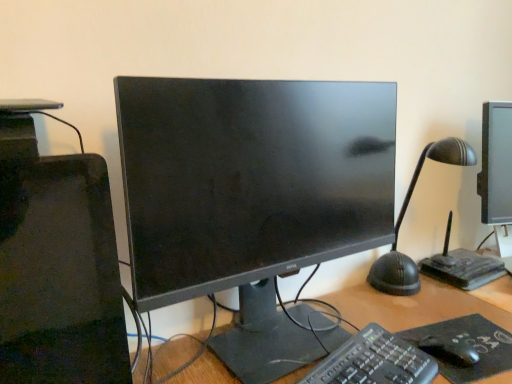
Locate an element on the screen. matte black monitor at center is located at coordinates click(252, 196).

What is the approximate height of matte black monitor at center?

It is 21.86 inches.

This screenshot has width=512, height=384. What are the coordinates of `matte black monitor at center` in the screenshot? It's located at (252, 196).

From a real-world perspective, relative to matte black monitor at center, is black matte mouse at lower right vertically above or below?

black matte mouse at lower right is situated lower than matte black monitor at center in the real world.

Which object is thinner, black matte mouse at lower right or matte black monitor at center?

black matte mouse at lower right.

Would you say black matte mouse at lower right is to the left or to the right of matte black monitor at center in the picture?

From the image, it's evident that black matte mouse at lower right is to the right of matte black monitor at center.

From the image's perspective, which is below, black matte mouse at lower right or matte black monitor at center?

From the image's view, black matte mouse at lower right is below.

Is black plastic keyboard at center wider or thinner than black matte mouse at lower right?

Clearly, black plastic keyboard at center has more width compared to black matte mouse at lower right.

Is black plastic keyboard at center positioned beyond the bounds of black matte mouse at lower right?

Yes, black plastic keyboard at center is not within black matte mouse at lower right.

From a real-world perspective, is black plastic keyboard at center physically below black matte mouse at lower right?

Incorrect, from a real-world perspective, black plastic keyboard at center is higher than black matte mouse at lower right.

Considering the sizes of objects black plastic keyboard at center and black matte mouse at lower right in the image provided, who is taller, black plastic keyboard at center or black matte mouse at lower right?

black plastic keyboard at center is taller.

Is matte black monitor at center facing away from black plastic keyboard at center?

No, black plastic keyboard at center is not at the back of matte black monitor at center.

Is matte black monitor at center further to the viewer compared to black plastic keyboard at center?

That is True.

Does matte black monitor at center have a smaller size compared to black plastic keyboard at center?

Actually, matte black monitor at center might be larger than black plastic keyboard at center.

Does black matte mouse at lower right lie in front of black plastic keyboard at center?

No, it is behind black plastic keyboard at center.

Consider the image. Is black matte mouse at lower right positioned far away from black plastic keyboard at center?

black matte mouse at lower right is near black plastic keyboard at center, not far away.

From a real-world perspective, who is located higher, black matte mouse at lower right or black plastic keyboard at center?

black plastic keyboard at center is physically above.

Which object is positioned more to the left, black matte mouse at lower right or black plastic keyboard at center?

black plastic keyboard at center.

Does black plastic keyboard at center turn towards matte black monitor at center?

No, black plastic keyboard at center is not aimed at matte black monitor at center.

Based on the photo, from a real-world perspective, who is located higher, black plastic keyboard at center or matte black monitor at center?

matte black monitor at center is physically above.

At what (x,y) coordinates should I click in order to perform the action: click on computer keyboard below the matte black monitor at center (from a real-world perspective). Please return your answer as a coordinate pair (x, y). The height and width of the screenshot is (384, 512). Looking at the image, I should click on (374, 361).

Who is shorter, black plastic keyboard at center or matte black monitor at center?

black plastic keyboard at center.

Looking at this image, is matte black monitor at center in front of or behind black matte mouse at lower right in the image?

matte black monitor at center is positioned closer to the viewer than black matte mouse at lower right.

Between matte black monitor at center and black matte mouse at lower right, which one appears on the right side from the viewer's perspective?

Positioned to the right is black matte mouse at lower right.

Looking at their sizes, would you say matte black monitor at center is wider or thinner than black matte mouse at lower right?

matte black monitor at center is wider than black matte mouse at lower right.

Is matte black monitor at center facing towards black matte mouse at lower right?

Yes, matte black monitor at center is turned towards black matte mouse at lower right.

From a real-world perspective, between black matte mousepad at lower right and black plastic keyboard at center, who is vertically higher?

In real-world perspective, black plastic keyboard at center is above.

Considering the positions of objects black matte mousepad at lower right and black plastic keyboard at center in the image provided, who is in front, black matte mousepad at lower right or black plastic keyboard at center?

black plastic keyboard at center is in front.

Based on the photo, is black matte mousepad at lower right looking in the opposite direction of black plastic keyboard at center?

No, black plastic keyboard at center is not at the back of black matte mousepad at lower right.

I want to click on computer monitor in front of the black matte mouse at lower right, so click(252, 196).

At what (x,y) coordinates should I click in order to perform the action: click on mouse below the black plastic keyboard at center (from a real-world perspective). Please return your answer as a coordinate pair (x, y). The height and width of the screenshot is (384, 512). Looking at the image, I should click on (449, 350).

Estimate the real-world distances between objects in this image. Which object is closer to black matte mousepad at lower right, matte black monitor at center or black matte mouse at lower right?

Among the two, black matte mouse at lower right is located nearer to black matte mousepad at lower right.

When comparing their distances from black matte mouse at lower right, does black matte mousepad at lower right or matte black monitor at center seem closer?

Among the two, black matte mousepad at lower right is located nearer to black matte mouse at lower right.

From the image, which object appears to be farther from black plastic keyboard at center, black matte mouse at lower right or black matte mousepad at lower right?

black matte mousepad at lower right.

Estimate the real-world distances between objects in this image. Which object is further from black matte mousepad at lower right, black plastic keyboard at center or matte black monitor at center?

The object further to black matte mousepad at lower right is matte black monitor at center.

Looking at the image, which one is located further to black matte mouse at lower right, matte black monitor at center or black matte mousepad at lower right?

matte black monitor at center lies further to black matte mouse at lower right than the other object.

From the image, which object appears to be farther from matte black monitor at center, black matte mousepad at lower right or black matte mouse at lower right?

black matte mouse at lower right is positioned further to the anchor matte black monitor at center.

When comparing their distances from black matte mousepad at lower right, does black plastic keyboard at center or black matte mouse at lower right seem closer?

Among the two, black matte mouse at lower right is located nearer to black matte mousepad at lower right.

Which object lies further to the anchor point black plastic keyboard at center, black matte mouse at lower right or matte black monitor at center?

Based on the image, matte black monitor at center appears to be further to black plastic keyboard at center.

Locate an element on the screen. The width and height of the screenshot is (512, 384). computer keyboard situated between matte black monitor at center and black matte mousepad at lower right from left to right is located at coordinates (374, 361).

At what (x,y) coordinates should I click in order to perform the action: click on mousepad positioned between black plastic keyboard at center and black matte mouse at lower right from near to far. Please return your answer as a coordinate pair (x, y). The image size is (512, 384). Looking at the image, I should click on (471, 344).

Where is `computer keyboard between matte black monitor at center and black matte mouse at lower right from left to right`? computer keyboard between matte black monitor at center and black matte mouse at lower right from left to right is located at coordinates click(x=374, y=361).

Find the location of a particular element. The height and width of the screenshot is (384, 512). mouse located between matte black monitor at center and black matte mousepad at lower right in the left-right direction is located at coordinates (449, 350).